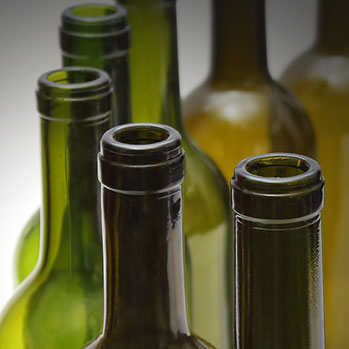
Where is `bottle`? This screenshot has height=349, width=349. bottle is located at coordinates (212, 261).